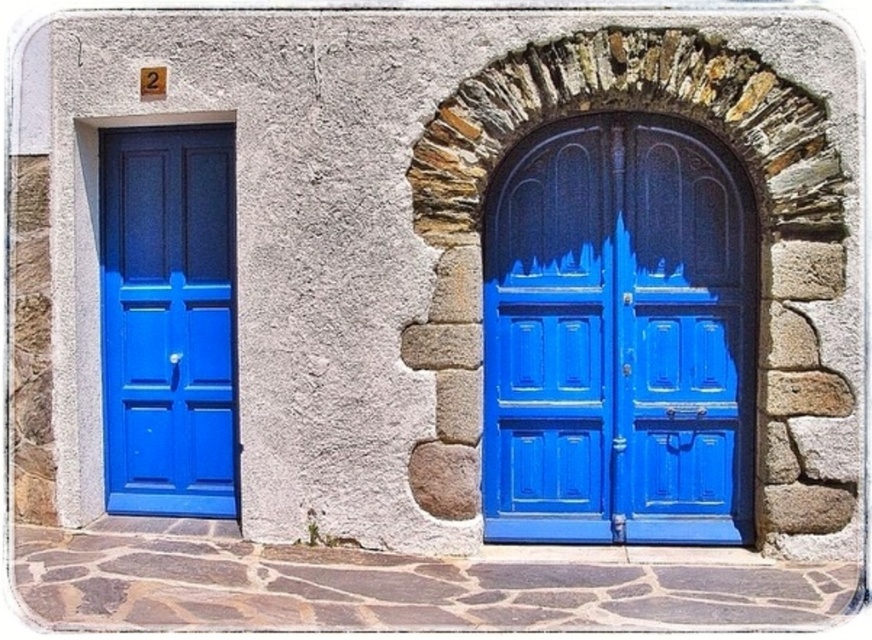
Question: Which object appears farthest from the camera in this image?

Choices:
 (A) matte blue door at center
 (B) matte blue door at left

Answer: (B)

Question: Which of the following is the closest to the observer?

Choices:
 (A) matte blue door at left
 (B) matte blue door at center

Answer: (B)

Question: Is matte blue door at center behind matte blue door at left?

Choices:
 (A) yes
 (B) no

Answer: (B)

Question: Which point is closer to the camera taking this photo?

Choices:
 (A) (632, 176)
 (B) (179, 385)

Answer: (A)

Question: In this image, where is matte blue door at center located relative to matte blue door at left?

Choices:
 (A) right
 (B) left

Answer: (A)

Question: Does matte blue door at center have a smaller size compared to matte blue door at left?

Choices:
 (A) no
 (B) yes

Answer: (A)